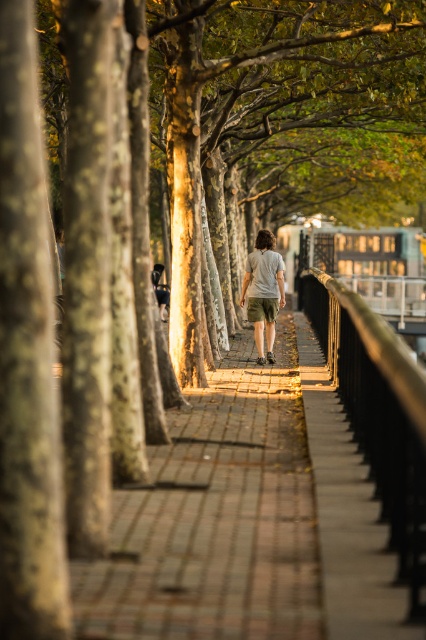
Question: Which point is farther to the camera?

Choices:
 (A) metallic rail at right
 (B) khaki shorts at center

Answer: (B)

Question: Is metallic rail at right bigger than khaki shorts at center?

Choices:
 (A) yes
 (B) no

Answer: (A)

Question: Which point is closer to the camera?

Choices:
 (A) metallic rail at right
 (B) khaki shorts at center
 (C) brick paved walkway at center

Answer: (A)

Question: Which is nearer to the khaki shorts at center?

Choices:
 (A) brick paved walkway at center
 (B) metallic rail at right

Answer: (B)

Question: Can you confirm if brick paved walkway at center is bigger than metallic rail at right?

Choices:
 (A) no
 (B) yes

Answer: (A)

Question: Does brick paved walkway at center come in front of khaki shorts at center?

Choices:
 (A) no
 (B) yes

Answer: (B)